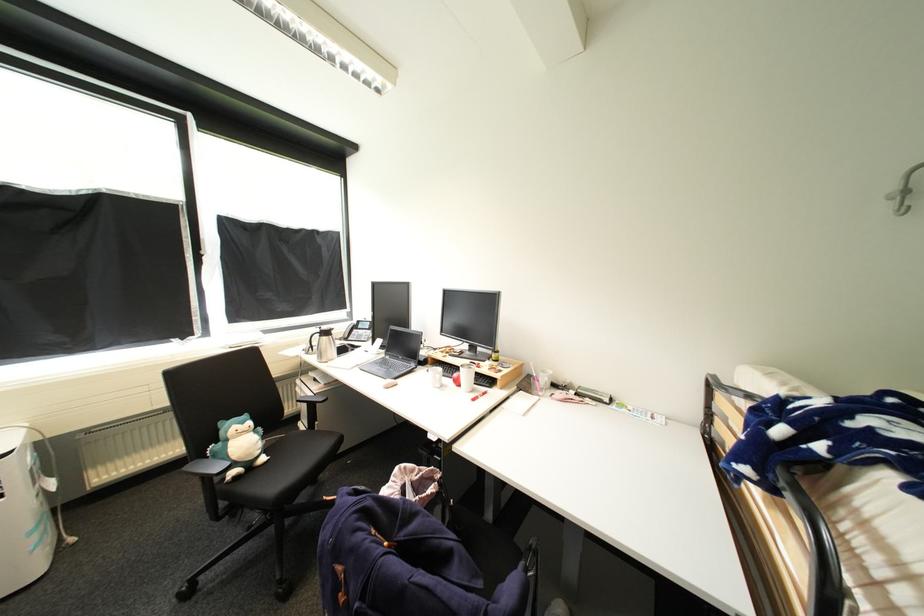
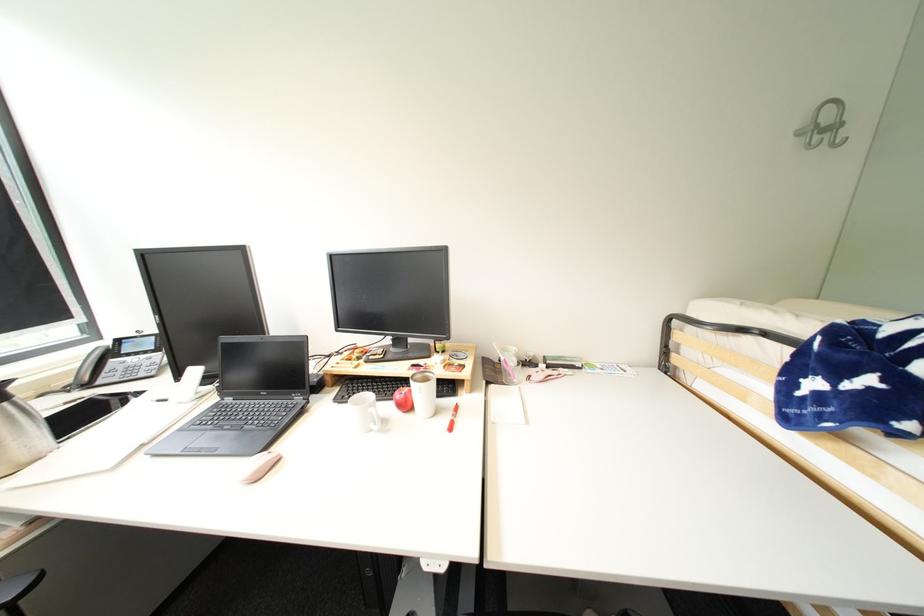
The point at (x=462, y=376) is marked in the first image. Where is the corresponding point in the second image?

(405, 397)